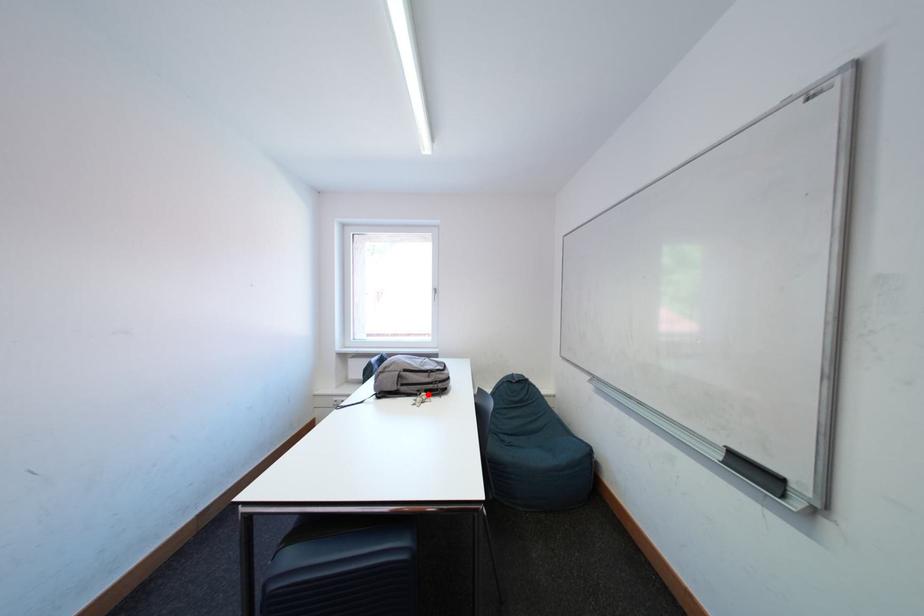
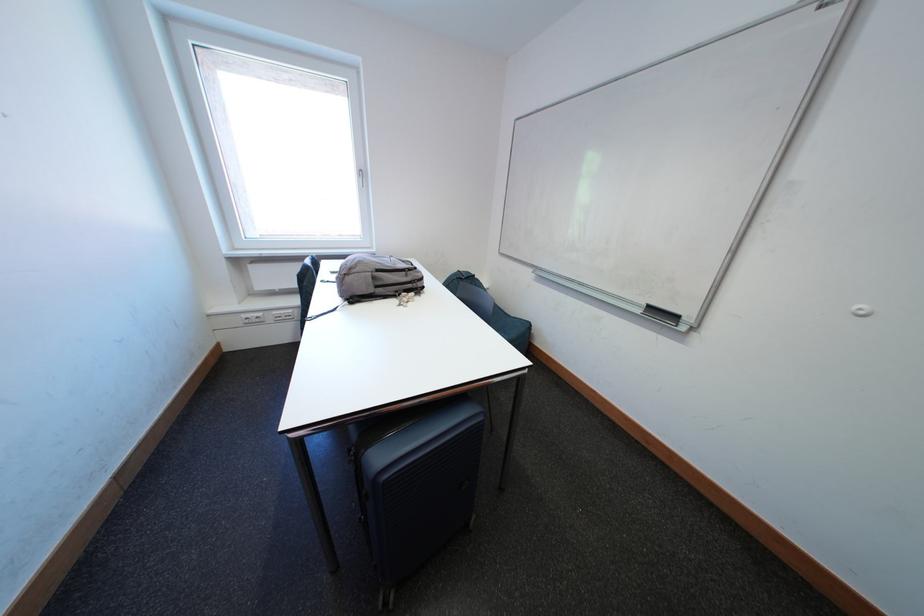
In the second image, find the point that corresponds to the highlighted location in the first image.

(406, 294)